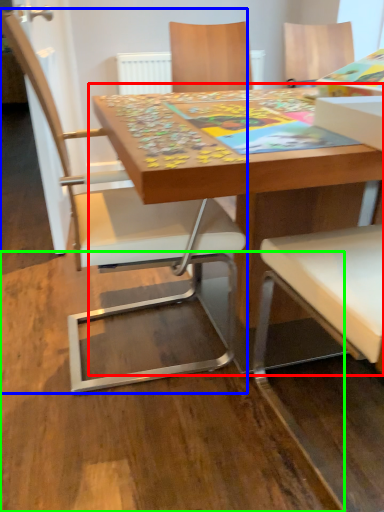
Question: Which object is positioned farthest from table (highlighted by a red box)? Select from chair (highlighted by a blue box) and plywood (highlighted by a green box).

Choices:
 (A) chair
 (B) plywood

Answer: (B)